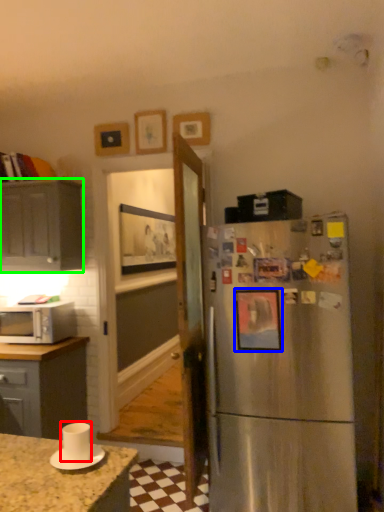
Question: Which object is positioned closest to appliance (highlighted by a red box)? Select from picture frame (highlighted by a blue box) and cabinetry (highlighted by a green box).

Choices:
 (A) picture frame
 (B) cabinetry

Answer: (A)